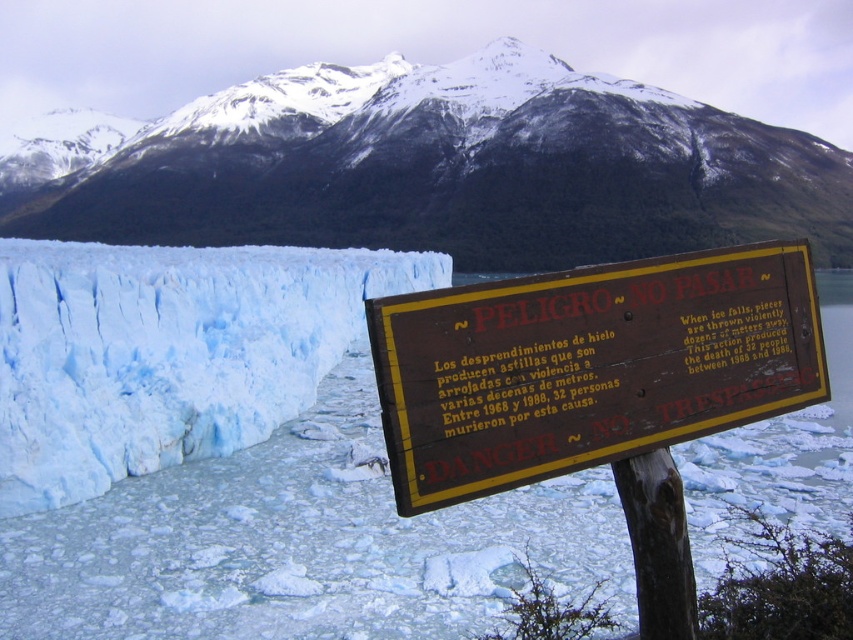
You are a hiker carrying a 3 meter long tent pole. You see the brown wooden sign at center and the narrow pathway carved through the ice. Can you fit the tent pole between them without bending it?

The distance between the brown wooden sign at center and the narrow pathway carved through the ice is 3.55 meters. Since the tent pole is 3 meters long, it can fit between them without bending.